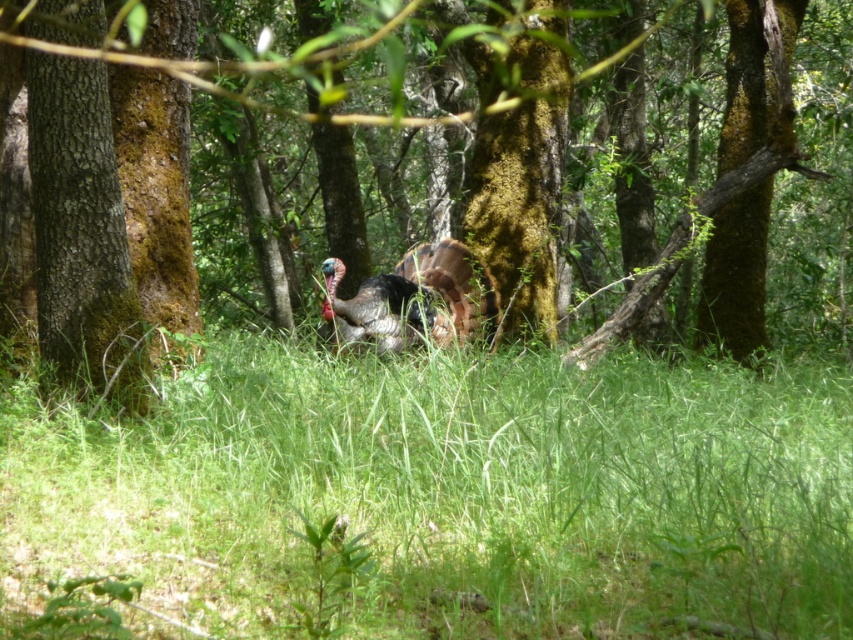
You are a hiker who wants to take a photo of the shiny black turkey at center and the brown mossy tree at center. If your camera has a 2.5 feet focus range, can you focus on both objects at the same time?

The shiny black turkey at center is 3.31 feet from the brown mossy tree at center. Since the distance between them is greater than the camera focus range of 2.5 feet, you cannot focus on both objects simultaneously.

In the scene shown: You are a hiker trying to identify the widest area between two landmarks in the forest. You see the green grassy at center and the brown mossy tree at center. Which one has a wider area?

The brown mossy tree at center has a wider area than the green grassy at center because the green grassy at center is narrower in width compared to the brown mossy tree at center.